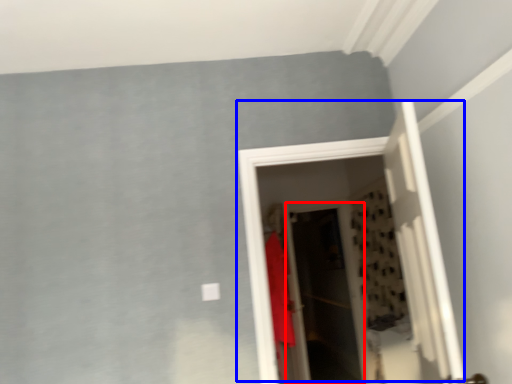
Question: Among these objects, which one is nearest to the camera, screen door (highlighted by a red box) or door (highlighted by a blue box)?

Choices:
 (A) screen door
 (B) door

Answer: (B)